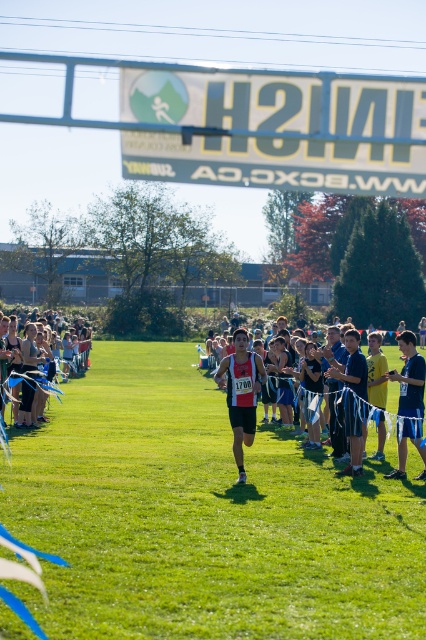
Question: Is black fabric running suit at center further to the viewer compared to matte black tank top at center?

Choices:
 (A) yes
 (B) no

Answer: (B)

Question: Which object is positioned closest to the matte black runner at center?

Choices:
 (A) matte black tank top at center
 (B) white plastic banner at upper center
 (C) blue athletic shorts at right

Answer: (A)

Question: Can you confirm if matte black runner at center is smaller than black fabric running suit at center?

Choices:
 (A) no
 (B) yes

Answer: (A)

Question: Which object is positioned farthest from the white plastic banner at upper center?

Choices:
 (A) matte black tank top at center
 (B) matte black runner at center
 (C) blue athletic shorts at right

Answer: (A)

Question: Based on their relative distances, which object is nearer to the matte black runner at center?

Choices:
 (A) white plastic banner at upper center
 (B) matte black running suit at center
 (C) blue athletic shorts at right
 (D) matte black tank top at center

Answer: (D)

Question: Is matte black runner at center below black fabric running suit at center?

Choices:
 (A) yes
 (B) no

Answer: (A)